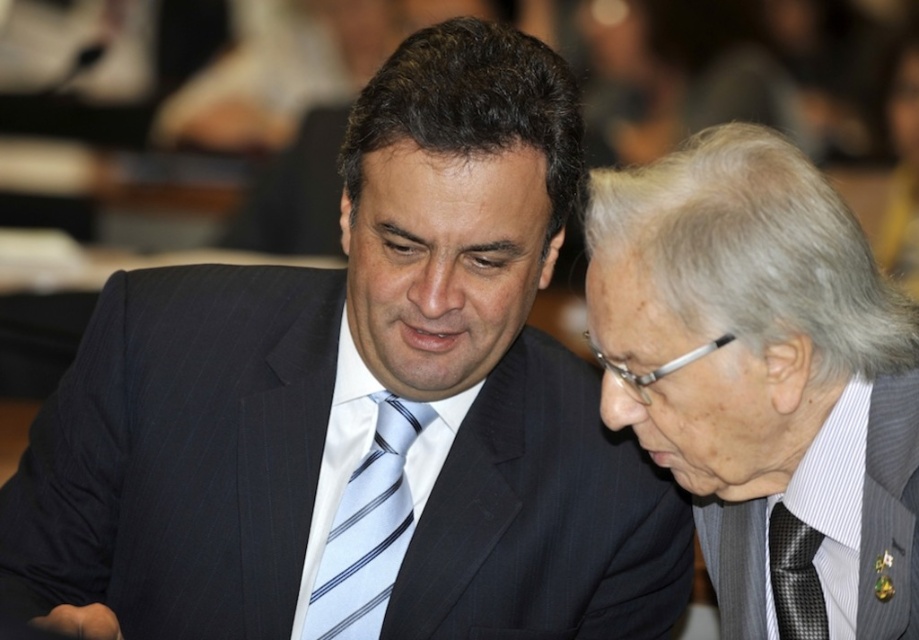
Locate an element on the screen. The image size is (919, 640). dark blue pinstripe suit at center is located at coordinates (364, 412).

Is dark blue pinstripe suit at center below black textured tie at lower right?

Actually, dark blue pinstripe suit at center is above black textured tie at lower right.

I want to click on dark blue pinstripe suit at center, so click(x=364, y=412).

At what (x,y) coordinates should I click in order to perform the action: click on dark blue pinstripe suit at center. Please return your answer as a coordinate pair (x, y). The image size is (919, 640). Looking at the image, I should click on (364, 412).

Which is in front, point (65, 467) or point (685, 317)?

Point (685, 317) is more forward.

Between dark blue pinstripe suit at center and gray textured suit at right, which one is positioned lower?

Positioned lower is dark blue pinstripe suit at center.

Between point (395, 579) and point (732, 342), which one is positioned behind?

The point (395, 579) is behind.

Where is `dark blue pinstripe suit at center`? dark blue pinstripe suit at center is located at coordinates (364, 412).

Can you confirm if dark blue pinstripe suit at center is positioned below light blue striped tie at center?

Actually, dark blue pinstripe suit at center is above light blue striped tie at center.

Does point (369, 321) lie in front of point (305, 620)?

Yes, it is.

At what (x,y) coordinates should I click in order to perform the action: click on dark blue pinstripe suit at center. Please return your answer as a coordinate pair (x, y). The image size is (919, 640). Looking at the image, I should click on (364, 412).